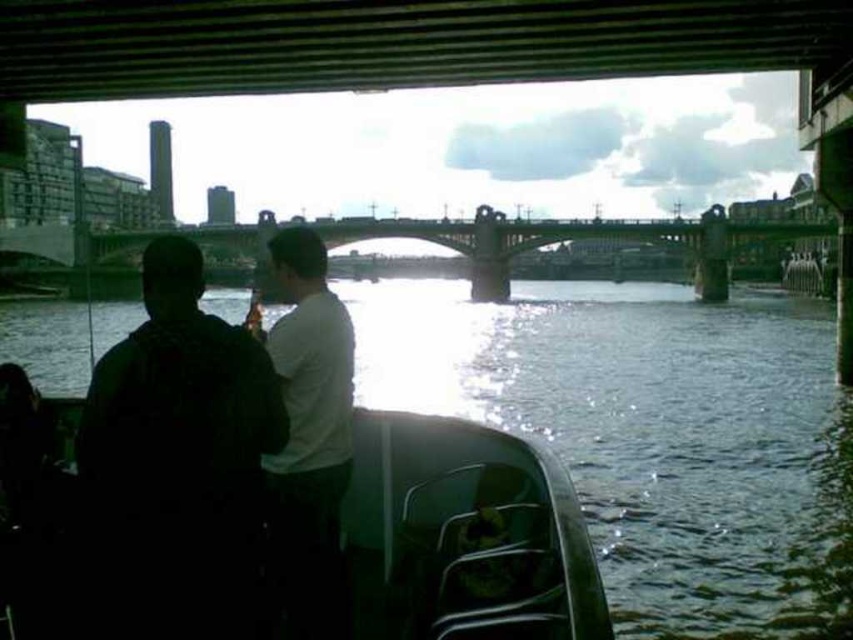
Question: Considering the real-world distances, which object is farthest from the dark fabric shirt at left?

Choices:
 (A) white matte shirt at center
 (B) greenish water at lower center

Answer: (B)

Question: Does greenish water at lower center lie behind white matte shirt at center?

Choices:
 (A) no
 (B) yes

Answer: (B)

Question: Which point is closer to the camera taking this photo?

Choices:
 (A) click(260, 266)
 (B) click(167, 609)

Answer: (B)

Question: Can you confirm if greenish water at lower center is bigger than concrete bridge at center?

Choices:
 (A) yes
 (B) no

Answer: (A)

Question: Can you confirm if greenish water at lower center is positioned to the left of dark fabric shirt at left?

Choices:
 (A) yes
 (B) no

Answer: (B)

Question: Which point appears farthest from the camera in this image?

Choices:
 (A) (312, 413)
 (B) (535, 225)

Answer: (B)